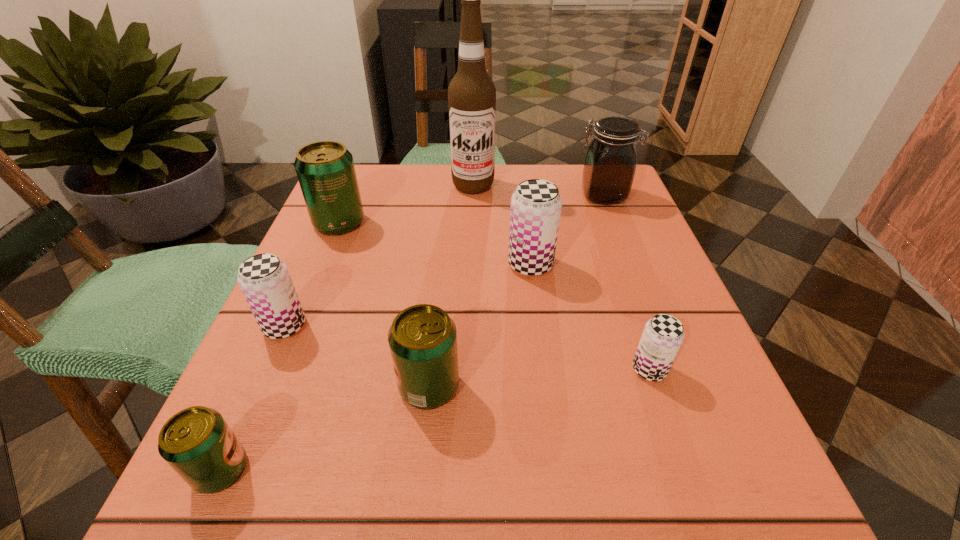
Locate an element on the screen. The image size is (960, 540). free spot located on the right of the leftmost purple beer can is located at coordinates (475, 326).

At what (x,y) coordinates should I click in order to perform the action: click on vacant space located 0.130m on the right of the rightmost green beer can. Please return your answer as a coordinate pair (x, y). Image resolution: width=960 pixels, height=540 pixels. Looking at the image, I should click on (548, 386).

I want to click on vacant space situated on the back of the rightmost beer can, so click(596, 214).

At what (x,y) coordinates should I click in order to perform the action: click on vacant space located 0.200m on the right of the nearest object. Please return your answer as a coordinate pair (x, y). Looking at the image, I should click on (407, 470).

You are a GUI agent. You are given a task and a screenshot of the screen. Output one action in this format:
    pyautogui.click(x=<x>, y=<y>)
    Task: Click on the alcohol at the far edge
    The width and height of the screenshot is (960, 540).
    Given the screenshot: What is the action you would take?
    coord(471,94)

Where is `jar located in the far edge section of the desktop`? The height and width of the screenshot is (540, 960). jar located in the far edge section of the desktop is located at coordinates (610, 162).

This screenshot has width=960, height=540. I want to click on beer can situated at the far edge, so click(325, 169).

Image resolution: width=960 pixels, height=540 pixels. Find the location of `object that is at the near edge`. object that is at the near edge is located at coordinates pos(197,443).

At what (x,y) coordinates should I click in order to perform the action: click on jar that is at the right edge. Please return your answer as a coordinate pair (x, y). This screenshot has height=540, width=960. Looking at the image, I should click on (610, 162).

You are a GUI agent. You are given a task and a screenshot of the screen. Output one action in this format:
    pyautogui.click(x=<x>, y=<y>)
    Task: Click on the beer can that is positioned at the right edge
    The width and height of the screenshot is (960, 540).
    Given the screenshot: What is the action you would take?
    pyautogui.click(x=663, y=335)